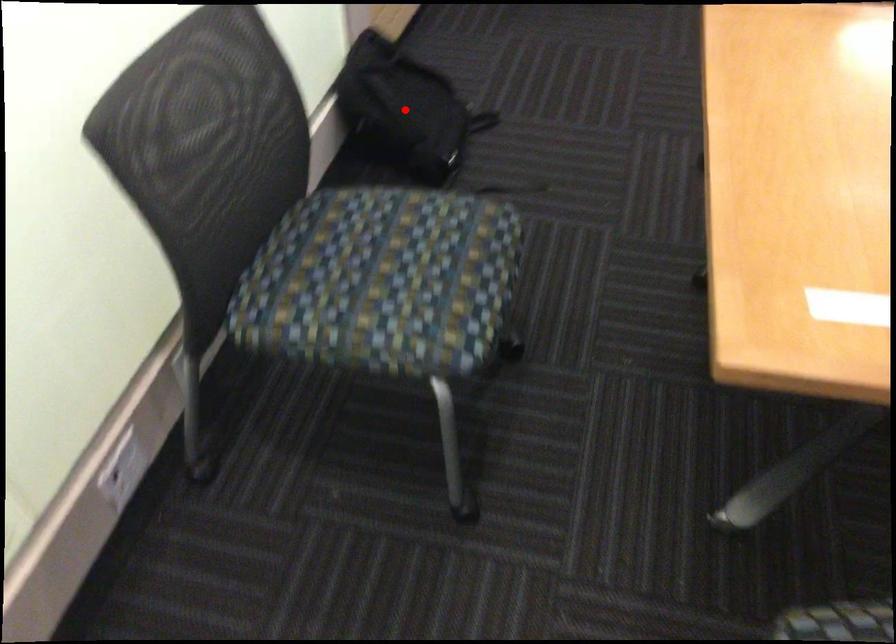
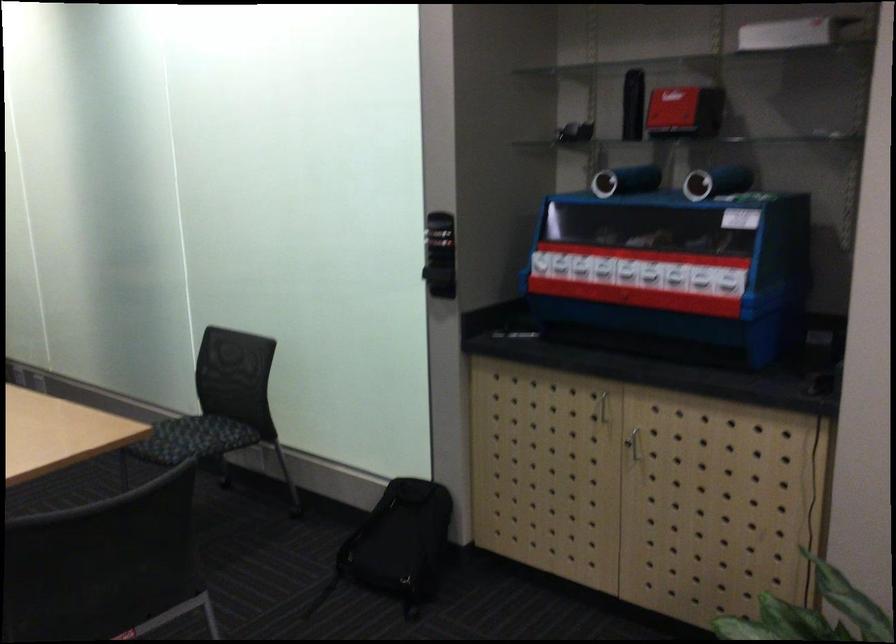
Question: I am providing you with two images of the same scene from different viewpoints. A red point is marked on the first image. Is the red point's position out of view in image 2?

Choices:
 (A) Yes
 (B) No

Answer: (A)